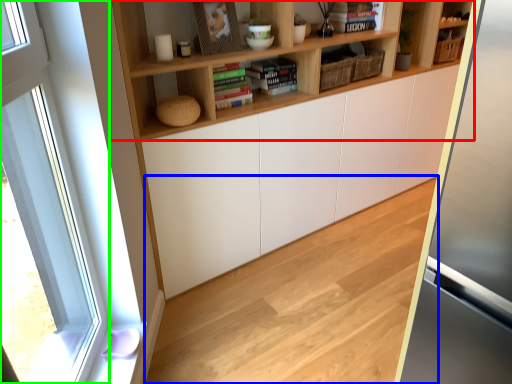
Question: Considering the real-world distances, which object is farthest from shelf (highlighted by a red box)? hardwood (highlighted by a blue box) or window (highlighted by a green box)?

Choices:
 (A) hardwood
 (B) window

Answer: (A)